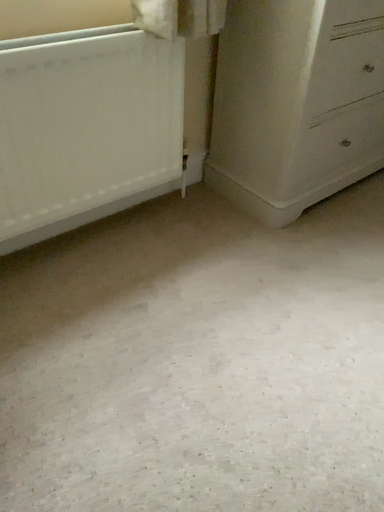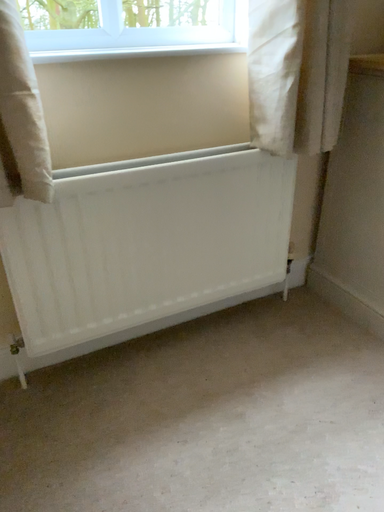
Question: How did the camera likely rotate when shooting the video?

Choices:
 (A) rotated left
 (B) rotated right

Answer: (A)